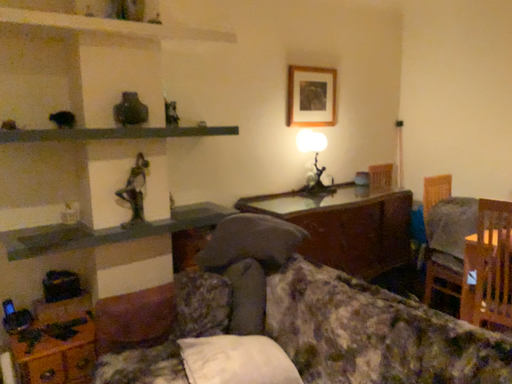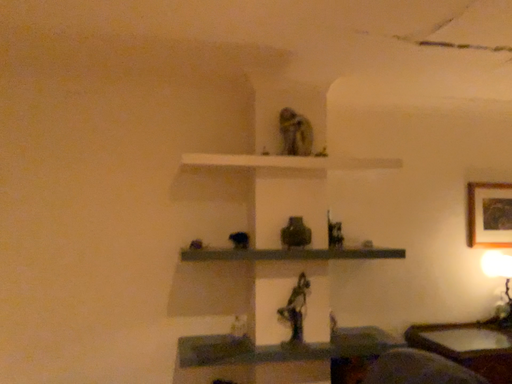
Question: Which way did the camera rotate in the video?

Choices:
 (A) rotated upward
 (B) rotated downward

Answer: (A)